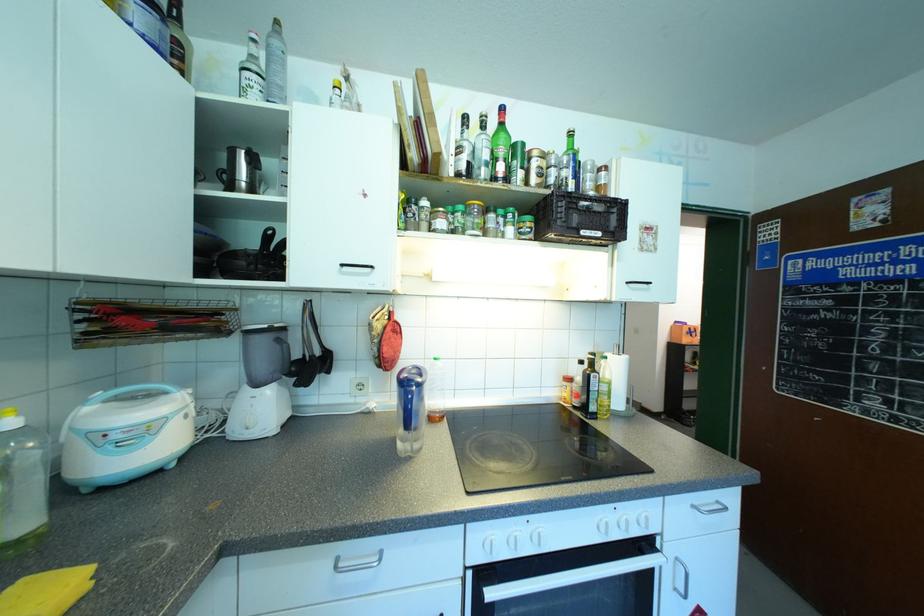
Where would you lift the small black crate? Please return your answer as a coordinate pair (x, y).

(579, 219)